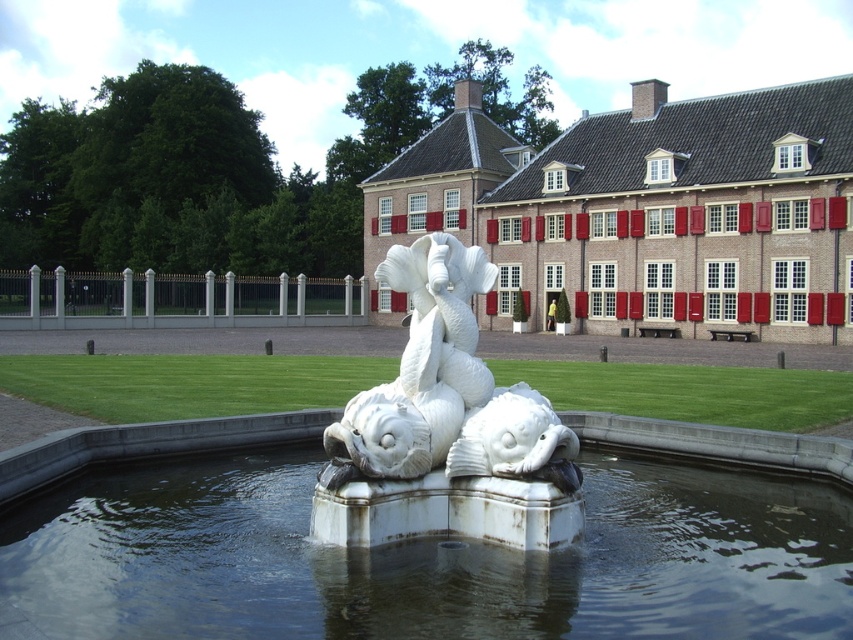
Does clear water at fountain center appear on the right side of brick red building at center?

Correct, you'll find clear water at fountain center to the right of brick red building at center.

Does point (107, 563) lie in front of point (723, 285)?

Yes, point (107, 563) is closer to viewer.

Locate an element on the screen. The image size is (853, 640). clear water at fountain center is located at coordinates (422, 560).

Does brick red building at center have a lesser height compared to white marble fish at center?

No.

This screenshot has height=640, width=853. Identify the location of brick red building at center. (645, 209).

Identify the location of brick red building at center. The height and width of the screenshot is (640, 853). (645, 209).

Based on the photo, does clear water at fountain center lie behind white marble sculpture at center?

No, it is in front of white marble sculpture at center.

Locate an element on the screen. The image size is (853, 640). clear water at fountain center is located at coordinates (422, 560).